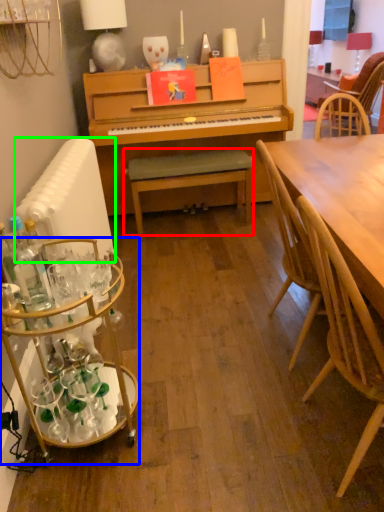
Question: Which object is positioned closest to bench (highlighted by a red box)? Select from desk (highlighted by a blue box) and radiator (highlighted by a green box).

Choices:
 (A) desk
 (B) radiator

Answer: (B)